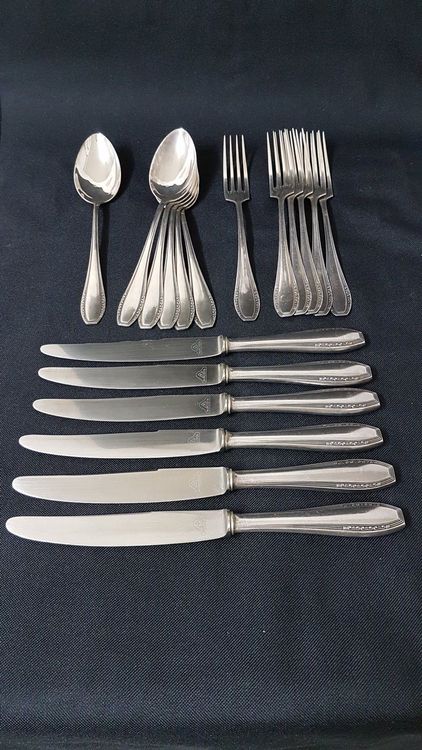
Identify the location of spoon bowls. (103, 171), (164, 171), (183, 190), (188, 193), (191, 195), (194, 200).